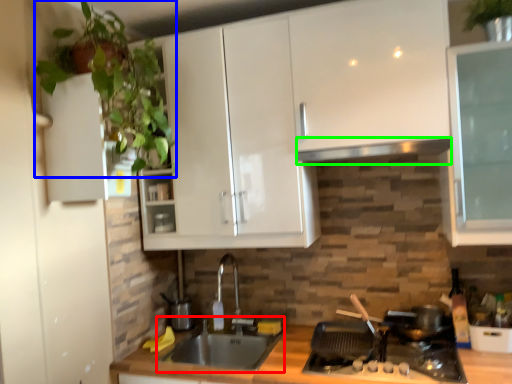
Question: Which object is positioned farthest from sink (highlighted by a red box)? Select from plant (highlighted by a blue box) and exhaust hood (highlighted by a green box).

Choices:
 (A) plant
 (B) exhaust hood

Answer: (A)